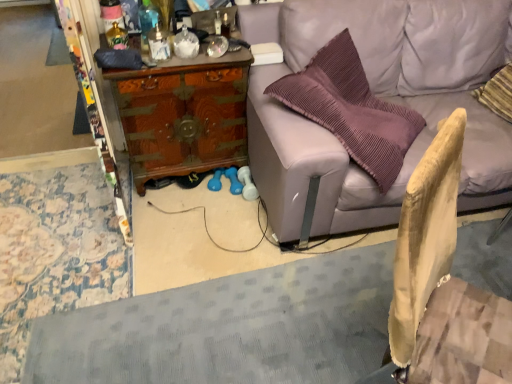
Measure the distance between light brown wood swivel chair at lower right and camera.

light brown wood swivel chair at lower right and camera are 31.44 inches apart.

What do you see at coordinates (159, 44) in the screenshot?
I see `translucent glass bottle at upper center, the first bottle in the right-to-left sequence` at bounding box center [159, 44].

Measure the distance between translucent glass bottle at upper center, the first bottle in the right-to-left sequence, and camera.

The distance of translucent glass bottle at upper center, the first bottle in the right-to-left sequence, from camera is 5.70 feet.

The height and width of the screenshot is (384, 512). Describe the element at coordinates (183, 115) in the screenshot. I see `wooden chest at center` at that location.

The height and width of the screenshot is (384, 512). I want to click on translucent glass bottle at upper left, which appears as the 2th bottle when viewed from the right, so click(117, 37).

Looking at this image, considering the relative sizes of translucent glass bottle at upper center, the first bottle in the right-to-left sequence, and wooden chest at center in the image provided, is translucent glass bottle at upper center, the first bottle in the right-to-left sequence, wider than wooden chest at center?

In fact, translucent glass bottle at upper center, the first bottle in the right-to-left sequence, might be narrower than wooden chest at center.

The image size is (512, 384). Identify the location of bottle that is the 2nd object located above the wooden chest at center (from the image's perspective). (159, 44).

Can you confirm if translucent glass bottle at upper center, the second bottle positioned from the left, is smaller than wooden chest at center?

Correct, translucent glass bottle at upper center, the second bottle positioned from the left, occupies less space than wooden chest at center.

Who is more distant, wooden chest at center or translucent glass bottle at upper left, which appears as the 2th bottle when viewed from the right?

wooden chest at center is behind.

How many degrees apart are the facing directions of wooden chest at center and translucent glass bottle at upper left, which is the first bottle in left-to-right order?

4.45 degrees separate the facing orientations of wooden chest at center and translucent glass bottle at upper left, which is the first bottle in left-to-right order.

Considering the sizes of objects wooden chest at center and translucent glass bottle at upper left, which is the first bottle in left-to-right order, in the image provided, who is taller, wooden chest at center or translucent glass bottle at upper left, which is the first bottle in left-to-right order,?

Standing taller between the two is wooden chest at center.

Could you measure the distance between wooden chest at center and translucent glass bottle at upper left, which appears as the 2th bottle when viewed from the right?

wooden chest at center is 17.19 inches away from translucent glass bottle at upper left, which appears as the 2th bottle when viewed from the right.

Does point (317, 188) come behind point (155, 40)?

No.

Is light purple leather couch at upper right with translucent glass bottle at upper center, the first bottle in the right-to-left sequence?

No, light purple leather couch at upper right is not touching translucent glass bottle at upper center, the first bottle in the right-to-left sequence.

Is translucent glass bottle at upper center, the second bottle positioned from the left, at the back of light purple leather couch at upper right?

That's not correct — light purple leather couch at upper right is not looking away from translucent glass bottle at upper center, the second bottle positioned from the left.

From the image's perspective, does light purple leather couch at upper right appear higher than translucent glass bottle at upper center, the first bottle in the right-to-left sequence?

No.

From the image's perspective, which one is positioned lower, wooden chest at center or light brown wood swivel chair at lower right?

light brown wood swivel chair at lower right is shown below in the image.

How much distance is there between wooden chest at center and light brown wood swivel chair at lower right?

The distance of wooden chest at center from light brown wood swivel chair at lower right is 1.24 meters.

Where is `swivel chair on the right of wooden chest at center`? The width and height of the screenshot is (512, 384). swivel chair on the right of wooden chest at center is located at coordinates (440, 286).

Does point (175, 69) come farther from viewer compared to point (430, 339)?

Yes, point (175, 69) is farther from viewer.

Considering the points (475, 381) and (135, 77), which point is in front, point (475, 381) or point (135, 77)?

Point (475, 381)

Which of these two, light brown wood swivel chair at lower right or wooden chest at center, stands taller?

Standing taller between the two is light brown wood swivel chair at lower right.

Does light brown wood swivel chair at lower right have a smaller size compared to wooden chest at center?

Correct, light brown wood swivel chair at lower right occupies less space than wooden chest at center.

From a real-world perspective, which object stands above the other?

In real-world perspective, light brown wood swivel chair at lower right is above.

Is point (182, 60) more distant than point (417, 6)?

No, (182, 60) is in front of (417, 6).

Looking at this image, which of these two, wooden chest at center or light purple leather couch at upper right, is smaller?

Smaller between the two is wooden chest at center.

From the picture: Is wooden chest at center next to light purple leather couch at upper right and touching it?

No, wooden chest at center is not with light purple leather couch at upper right.

Would you say translucent glass bottle at upper center, the first bottle in the right-to-left sequence, is outside translucent glass bottle at upper left, which is the first bottle in left-to-right order?

Yes, translucent glass bottle at upper center, the first bottle in the right-to-left sequence, is not within translucent glass bottle at upper left, which is the first bottle in left-to-right order.

Is translucent glass bottle at upper center, the second bottle positioned from the left, turned away from translucent glass bottle at upper left, which appears as the 2th bottle when viewed from the right?

That's not correct — translucent glass bottle at upper center, the second bottle positioned from the left, is not looking away from translucent glass bottle at upper left, which appears as the 2th bottle when viewed from the right.

From a real-world perspective, which object rests below the other?

translucent glass bottle at upper left, which is the first bottle in left-to-right order.

Which is more to the left, translucent glass bottle at upper center, the second bottle positioned from the left, or translucent glass bottle at upper left, which appears as the 2th bottle when viewed from the right?

translucent glass bottle at upper left, which appears as the 2th bottle when viewed from the right.

The image size is (512, 384). Identify the location of bottle that is the 2nd one when counting forward from the wooden chest at center. (159, 44).

The height and width of the screenshot is (384, 512). I want to click on the 2nd bottle counting from the left side of the wooden chest at center, so click(117, 37).

Which object lies nearer to the anchor point wooden chest at center, light brown wood swivel chair at lower right or translucent glass bottle at upper center, the second bottle positioned from the left?

translucent glass bottle at upper center, the second bottle positioned from the left, lies closer to wooden chest at center than the other object.

Looking at the image, which one is located closer to light purple leather couch at upper right, translucent glass bottle at upper left, which is the first bottle in left-to-right order, or wooden chest at center?

wooden chest at center is closer to light purple leather couch at upper right.

When comparing their distances from light purple leather couch at upper right, does translucent glass bottle at upper center, the first bottle in the right-to-left sequence, or wooden chest at center seem further?

Based on the image, translucent glass bottle at upper center, the first bottle in the right-to-left sequence, appears to be further to light purple leather couch at upper right.

Considering their positions, is translucent glass bottle at upper center, the second bottle positioned from the left, positioned closer to light brown wood swivel chair at lower right than translucent glass bottle at upper left, which is the first bottle in left-to-right order?

The object closer to light brown wood swivel chair at lower right is translucent glass bottle at upper center, the second bottle positioned from the left.

Which object lies nearer to the anchor point translucent glass bottle at upper center, the second bottle positioned from the left, wooden chest at center or light brown wood swivel chair at lower right?

Based on the image, wooden chest at center appears to be nearer to translucent glass bottle at upper center, the second bottle positioned from the left.

Estimate the real-world distances between objects in this image. Which object is further from light purple leather couch at upper right, wooden chest at center or light brown wood swivel chair at lower right?

Based on the image, light brown wood swivel chair at lower right appears to be further to light purple leather couch at upper right.

Which object lies further to the anchor point wooden chest at center, translucent glass bottle at upper left, which appears as the 2th bottle when viewed from the right, or translucent glass bottle at upper center, the first bottle in the right-to-left sequence?

translucent glass bottle at upper left, which appears as the 2th bottle when viewed from the right, is further to wooden chest at center.

Based on their spatial positions, is translucent glass bottle at upper left, which appears as the 2th bottle when viewed from the right, or translucent glass bottle at upper center, the first bottle in the right-to-left sequence, closer to light brown wood swivel chair at lower right?

Among the two, translucent glass bottle at upper center, the first bottle in the right-to-left sequence, is located nearer to light brown wood swivel chair at lower right.

You are a GUI agent. You are given a task and a screenshot of the screen. Output one action in this format:
    pyautogui.click(x=<x>, y=<y>)
    Task: Click on the bottle between translucent glass bottle at upper center, the second bottle positioned from the left, and wooden chest at center from top to bottom
    The image size is (512, 384).
    Given the screenshot: What is the action you would take?
    pyautogui.click(x=117, y=37)

I want to click on desk between translucent glass bottle at upper left, which appears as the 2th bottle when viewed from the right, and light purple leather couch at upper right, in the horizontal direction, so click(x=183, y=115).

Locate an element on the screen. This screenshot has width=512, height=384. bottle between translucent glass bottle at upper left, which appears as the 2th bottle when viewed from the right, and light purple leather couch at upper right, in the horizontal direction is located at coordinates (159, 44).

Find the location of `desk between translucent glass bottle at upper center, the first bottle in the right-to-left sequence, and light brown wood swivel chair at lower right`. desk between translucent glass bottle at upper center, the first bottle in the right-to-left sequence, and light brown wood swivel chair at lower right is located at coordinates (183, 115).